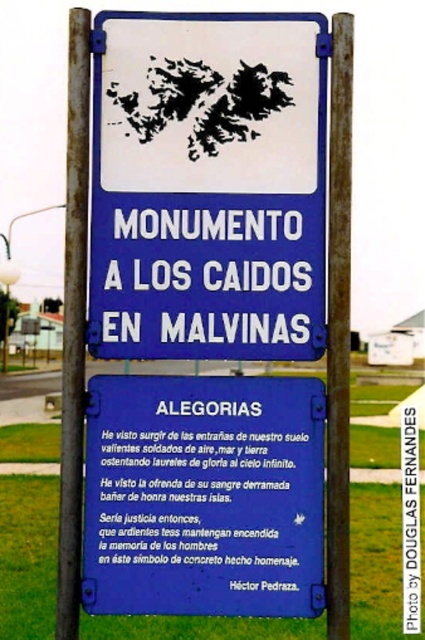
Question: Which object is farther from the camera taking this photo?

Choices:
 (A) rusty metal pole at left
 (B) white plastic sign at center
 (C) rusty metal pole at center

Answer: (B)

Question: Can you confirm if blue painted metal sign at center is bigger than rusty metal pole at center?

Choices:
 (A) no
 (B) yes

Answer: (B)

Question: Is rusty metal pole at left further to camera compared to rusty metal pole at center?

Choices:
 (A) no
 (B) yes

Answer: (B)

Question: Considering the real-world distances, which object is closest to the rusty metal pole at center?

Choices:
 (A) white plastic sign at center
 (B) blue painted metal sign at center
 (C) rusty metal pole at left

Answer: (A)

Question: Can you confirm if white plastic sign at center is bigger than blue painted metal sign at center?

Choices:
 (A) yes
 (B) no

Answer: (B)

Question: Based on their relative distances, which object is nearer to the rusty metal pole at center?

Choices:
 (A) blue painted metal sign at center
 (B) white plastic sign at center

Answer: (B)